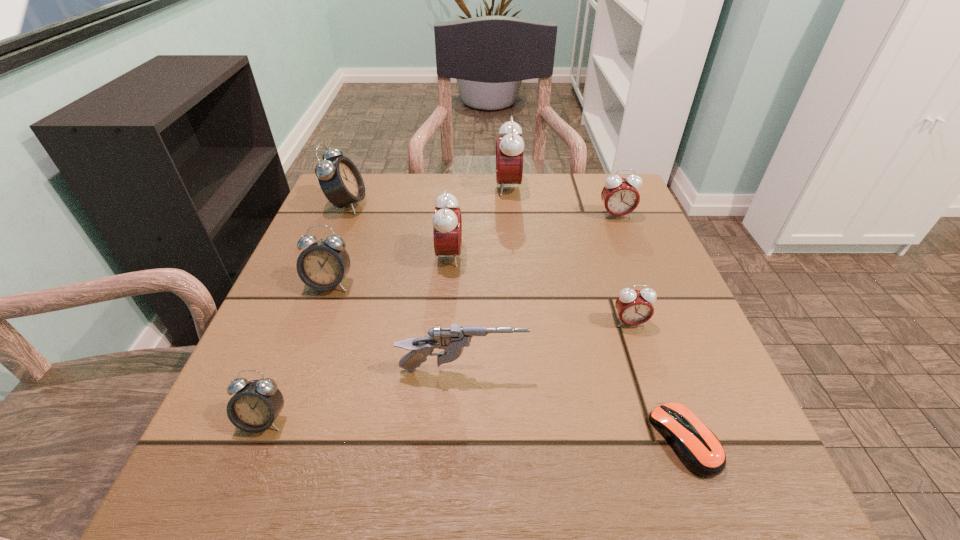
The width and height of the screenshot is (960, 540). I want to click on blank space located on the face of the second biggest white alarm clock, so click(281, 415).

Where is `free space located at the barrel of the third nearest object`? free space located at the barrel of the third nearest object is located at coordinates point(692,370).

Locate an element on the screen. This screenshot has height=540, width=960. vacant space situated 0.230m on the clock face of the smallest pink alarm clock is located at coordinates (674, 455).

I want to click on vacant space positioned 0.050m on the face of the smallest white alarm clock, so click(243, 472).

The image size is (960, 540). Identify the location of free space located on the back of the computer mouse. (636, 309).

Identify the location of object situated at the near edge. (698, 448).

Locate an element on the screen. This screenshot has height=540, width=960. computer mouse present at the right edge is located at coordinates (698, 448).

Where is `object present at the far left corner`? This screenshot has height=540, width=960. object present at the far left corner is located at coordinates (340, 180).

Identify the location of object that is at the far right corner. The image size is (960, 540). (619, 195).

Where is `object located at the near right corner`? object located at the near right corner is located at coordinates (698, 448).